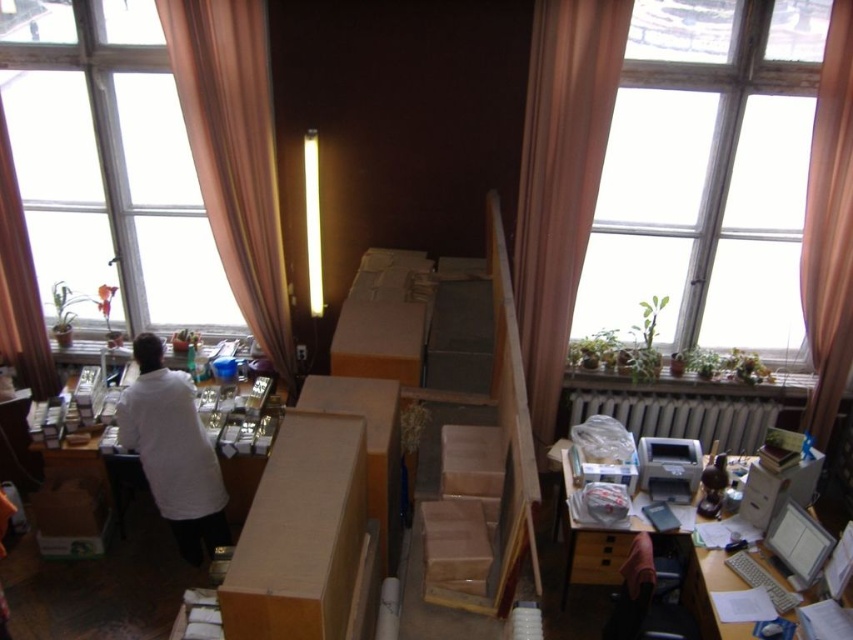
Based on the photo, does transparent glass window at upper center appear on the left side of pink fabric curtain at upper left?

Incorrect, transparent glass window at upper center is not on the left side of pink fabric curtain at upper left.

Describe the element at coordinates (708, 173) in the screenshot. I see `transparent glass window at upper center` at that location.

Find the location of a particular element. The image size is (853, 640). transparent glass window at upper center is located at coordinates (708, 173).

Looking at this image, is matte cardboard box at center in front of white matte table at center?

Yes, matte cardboard box at center is closer to the viewer.

What do you see at coordinates (300, 534) in the screenshot? I see `matte cardboard box at center` at bounding box center [300, 534].

What are the coordinates of `matte cardboard box at center` in the screenshot? It's located at (300, 534).

Is pink fabric curtain at left positioned at the back of white matte table at center?

Yes, pink fabric curtain at left is behind white matte table at center.

Identify the location of pink fabric curtain at left. Image resolution: width=853 pixels, height=640 pixels. (234, 154).